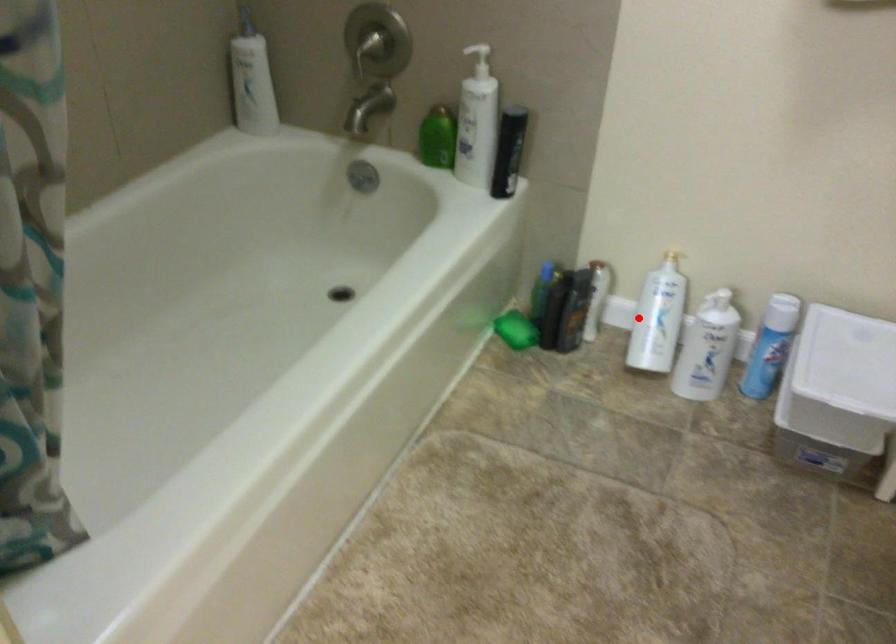
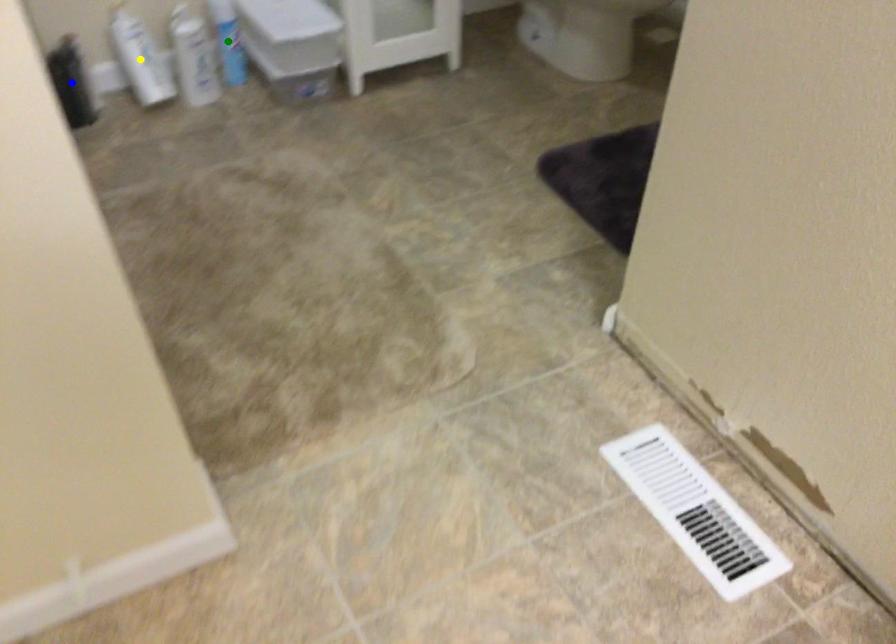
Question: I am providing you with two images of the same scene from different viewpoints. A red point is marked on the first image. You are given multiple points on the second image. Which point in image 2 is actually the same real-world point as the red point in image 1?

Choices:
 (A) yellow point
 (B) blue point
 (C) green point

Answer: (A)